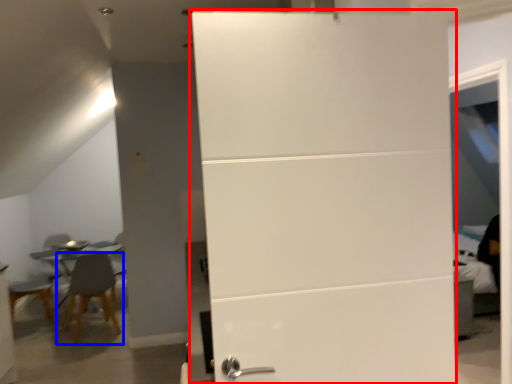
Question: Which point is closer to the camera, door (highlighted by a red box) or chair (highlighted by a blue box)?

Choices:
 (A) door
 (B) chair

Answer: (A)